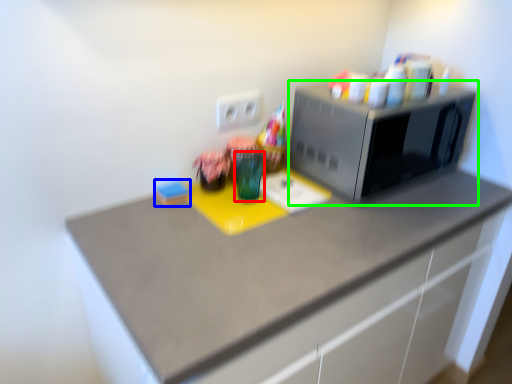
Question: Which is nearer to the glass vase (highlighted by a red box)? stationery (highlighted by a blue box) or microwave oven (highlighted by a green box).

Choices:
 (A) stationery
 (B) microwave oven

Answer: (A)